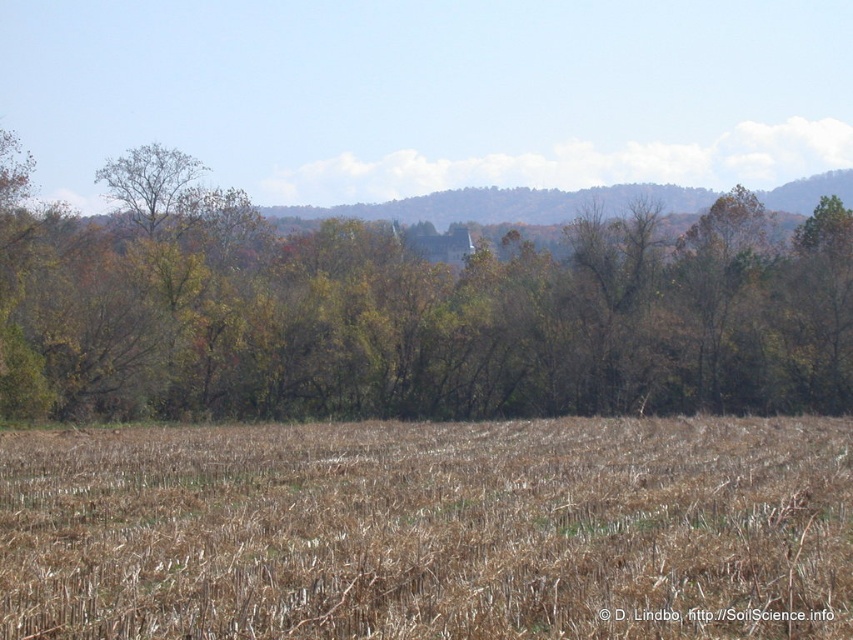
Does brown dry grass at center have a lesser width compared to green leafy tree at center?

Indeed, brown dry grass at center has a lesser width compared to green leafy tree at center.

The height and width of the screenshot is (640, 853). I want to click on brown dry grass at center, so click(x=431, y=531).

This screenshot has width=853, height=640. In order to click on brown dry grass at center in this screenshot , I will do `click(431, 531)`.